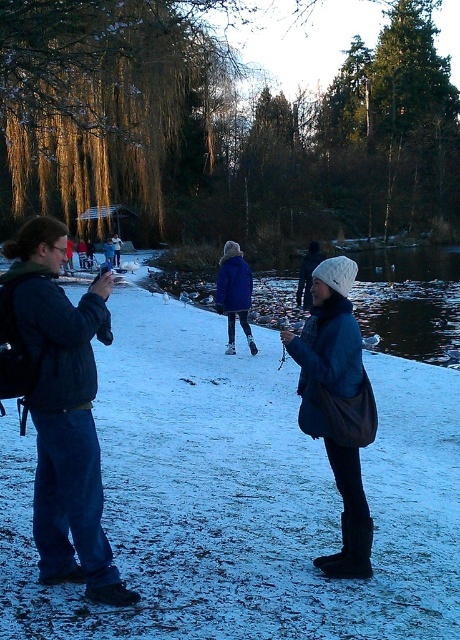
Question: Which point is closer to the camera taking this photo?

Choices:
 (A) (444, 314)
 (B) (343, 394)
 (C) (86, 582)
 (D) (224, 268)

Answer: (C)

Question: In this image, where is dark blue denim jacket at left located relative to blue woolen coat at center?

Choices:
 (A) below
 (B) above

Answer: (A)

Question: Which point is closer to the camera?

Choices:
 (A) blue woolen coat at center
 (B) dark blue denim jacket at left
 (C) glossy blue lake at center

Answer: (B)

Question: Can you confirm if dark blue denim jacket at left is positioned to the left of blue woolen coat at center?

Choices:
 (A) yes
 (B) no

Answer: (A)

Question: Is dark blue denim jacket at left positioned behind matte blue coat at center?

Choices:
 (A) yes
 (B) no

Answer: (B)

Question: Which object is closer to the camera taking this photo?

Choices:
 (A) glossy blue lake at center
 (B) matte blue coat at center

Answer: (B)